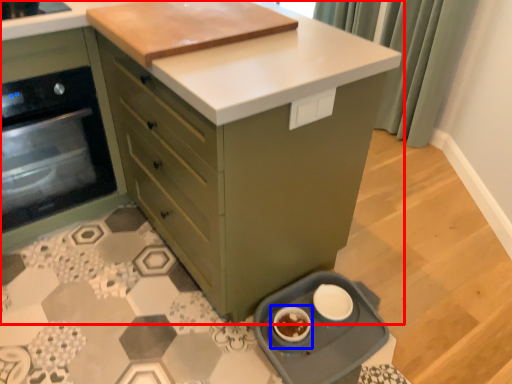
Question: Which of the following is the farthest to the observer, cabinetry (highlighted by a red box) or appliance (highlighted by a blue box)?

Choices:
 (A) cabinetry
 (B) appliance

Answer: (B)